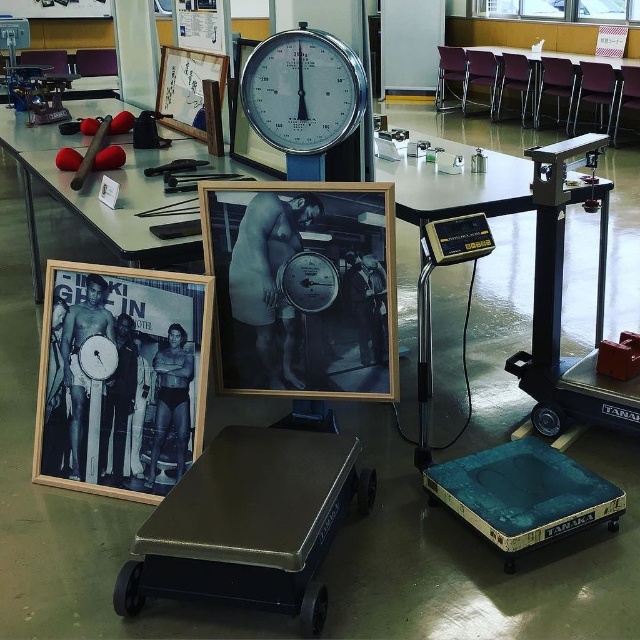
Can you confirm if wooden frame at left is positioned to the right of rubber mat at upper left?

Yes, wooden frame at left is to the right of rubber mat at upper left.

The image size is (640, 640). In order to click on wooden frame at left in this screenshot , I will do `click(120, 378)`.

Find the location of `wooden frame at left`. wooden frame at left is located at coordinates (120, 378).

Between metallic/reflective table at center and matte wooden picture frame at upper center, which one is positioned higher?

metallic/reflective table at center is above.

Is metallic/reflective table at center to the left of matte wooden picture frame at upper center from the viewer's perspective?

No, metallic/reflective table at center is not to the left of matte wooden picture frame at upper center.

This screenshot has width=640, height=640. What do you see at coordinates (545, 88) in the screenshot?
I see `metallic/reflective table at center` at bounding box center [545, 88].

This screenshot has height=640, width=640. In order to click on metallic/reflective table at center in this screenshot , I will do `click(545, 88)`.

Does metallic black cart at center have a greater width compared to rubber mat at upper left?

Yes.

Does metallic black cart at center have a smaller size compared to rubber mat at upper left?

Actually, metallic black cart at center might be larger than rubber mat at upper left.

Where is `metallic black cart at center`? The height and width of the screenshot is (640, 640). metallic black cart at center is located at coordinates (250, 524).

Find the location of `metallic black cart at center`. metallic black cart at center is located at coordinates (250, 524).